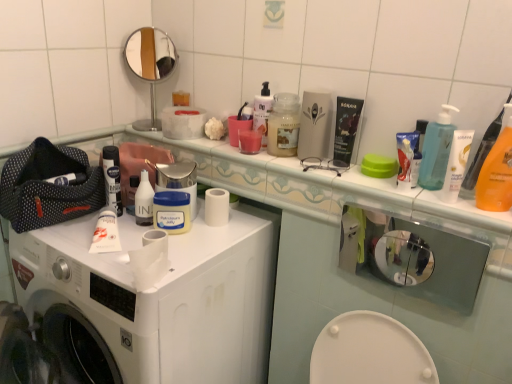
Where is `free space between metallic silver glasses at upper center and white plastic container at upper right, which is the second product from back to front`? The height and width of the screenshot is (384, 512). free space between metallic silver glasses at upper center and white plastic container at upper right, which is the second product from back to front is located at coordinates (367, 183).